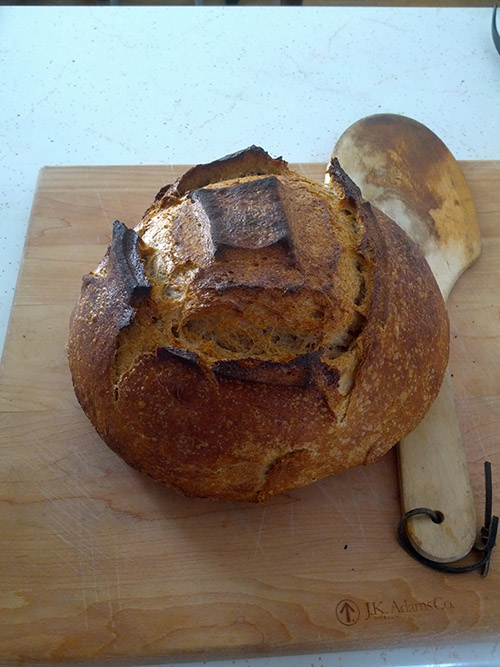
Where is `cutting board`? cutting board is located at coordinates (471, 452).